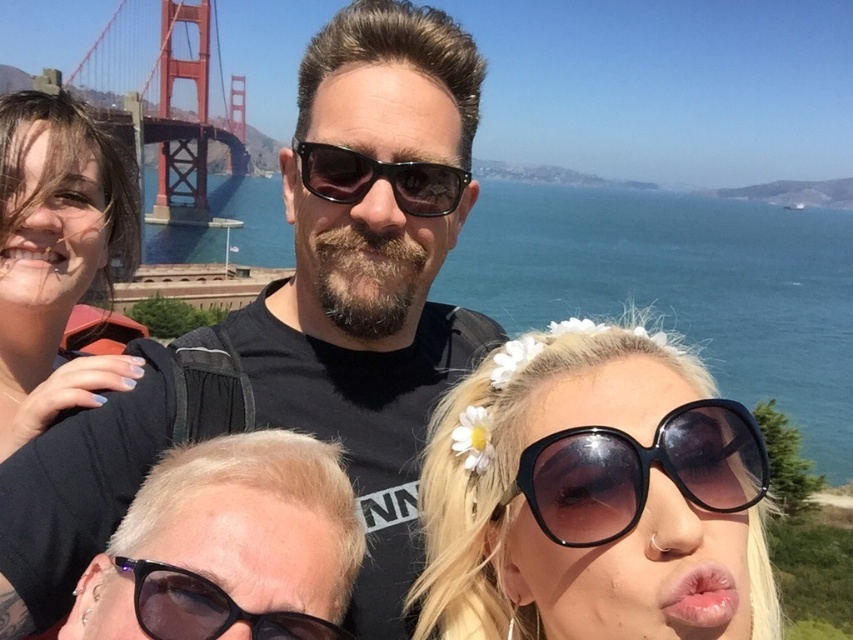
This screenshot has height=640, width=853. What do you see at coordinates (363, 362) in the screenshot?
I see `black matte sunglasses at center` at bounding box center [363, 362].

Does point (316, 426) come in front of point (341, 177)?

No.

I want to click on black matte sunglasses at center, so click(x=363, y=362).

At what (x,y) coordinates should I click in order to perform the action: click on black matte sunglasses at center. Please return your answer as a coordinate pair (x, y). This screenshot has width=853, height=640. Looking at the image, I should click on click(363, 362).

Can you confirm if red painted steel golden gate bridge at upper left is positioned below black plastic sunglasses at center?

Incorrect, red painted steel golden gate bridge at upper left is not positioned below black plastic sunglasses at center.

Is point (178, 163) positioned in front of point (368, 189)?

No.

Locate an element on the screen. The width and height of the screenshot is (853, 640). red painted steel golden gate bridge at upper left is located at coordinates (184, 124).

Is point (62, 608) farther from camera compared to point (62, 406)?

No, it is in front of (62, 406).

Is point (169, 374) less distant than point (45, 390)?

Yes.

Identify the location of black matte sunglasses at center. (363, 362).